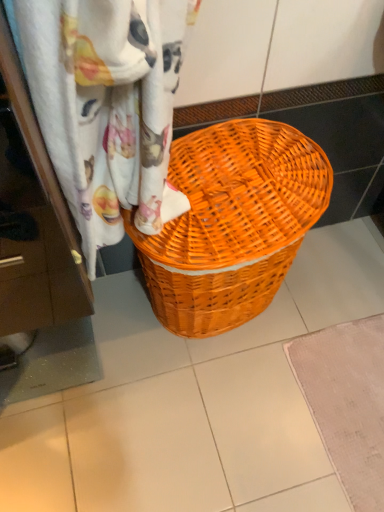
Measure the distance between woven fabric curtain at upper center and camera.

The depth of woven fabric curtain at upper center is 16.26 inches.

Describe the element at coordinates (232, 223) in the screenshot. I see `orange wicker basket at center` at that location.

Locate an element on the screen. woven fabric curtain at upper center is located at coordinates click(108, 106).

Considering the relative sizes of woven fabric curtain at upper center and beige textured bath mat at lower right in the image provided, is woven fabric curtain at upper center taller than beige textured bath mat at lower right?

Yes.

In the image, is woven fabric curtain at upper center positioned in front of or behind beige textured bath mat at lower right?

woven fabric curtain at upper center is in front of beige textured bath mat at lower right.

Considering the relative sizes of woven fabric curtain at upper center and beige textured bath mat at lower right in the image provided, is woven fabric curtain at upper center thinner than beige textured bath mat at lower right?

Yes, woven fabric curtain at upper center is thinner than beige textured bath mat at lower right.

Is orange wicker basket at center shorter than beige textured bath mat at lower right?

Incorrect, the height of orange wicker basket at center does not fall short of that of beige textured bath mat at lower right.

From a real-world perspective, which is physically above, orange wicker basket at center or beige textured bath mat at lower right?

orange wicker basket at center, from a real-world perspective.

Can you tell me how much woven fabric curtain at upper center and orange wicker basket at center differ in facing direction?

There is a 2.81-degree angle between the facing directions of woven fabric curtain at upper center and orange wicker basket at center.

From a real-world perspective, is woven fabric curtain at upper center positioned above or below orange wicker basket at center?

Clearly, from a real-world perspective, woven fabric curtain at upper center is above orange wicker basket at center.

Which is behind, woven fabric curtain at upper center or orange wicker basket at center?

orange wicker basket at center is behind.

Does point (94, 179) come in front of point (173, 265)?

Yes, it is.

Considering the relative sizes of orange wicker basket at center and woven fabric curtain at upper center in the image provided, is orange wicker basket at center wider than woven fabric curtain at upper center?

Yes, orange wicker basket at center is wider than woven fabric curtain at upper center.

From a real-world perspective, who is located lower, orange wicker basket at center or woven fabric curtain at upper center?

orange wicker basket at center.

The width and height of the screenshot is (384, 512). Find the location of `curtain on the left of the orange wicker basket at center`. curtain on the left of the orange wicker basket at center is located at coordinates coord(108,106).

From a real-world perspective, relative to orange wicker basket at center, is beige textured bath mat at lower right vertically above or below?

Clearly, from a real-world perspective, beige textured bath mat at lower right is below orange wicker basket at center.

Image resolution: width=384 pixels, height=512 pixels. In order to click on picnic basket lying above the beige textured bath mat at lower right (from the image's perspective) in this screenshot , I will do `click(232, 223)`.

Consider the image. How distant is beige textured bath mat at lower right from orange wicker basket at center?

beige textured bath mat at lower right and orange wicker basket at center are 15.15 inches apart from each other.

Is beige textured bath mat at lower right not within orange wicker basket at center?

Yes, beige textured bath mat at lower right is outside of orange wicker basket at center.

From a real-world perspective, is beige textured bath mat at lower right below woven fabric curtain at upper center?

Yes.

From the picture: Would you say beige textured bath mat at lower right is a long distance from woven fabric curtain at upper center?

No, beige textured bath mat at lower right is in close proximity to woven fabric curtain at upper center.

Can you confirm if beige textured bath mat at lower right is shorter than woven fabric curtain at upper center?

Yes.

Find the location of a particular element. Image resolution: width=384 pixels, height=512 pixels. curtain above the beige textured bath mat at lower right (from the image's perspective) is located at coordinates (108, 106).

Find the location of a particular element. bath mat lying on the right of orange wicker basket at center is located at coordinates (347, 402).

Estimate the real-world distances between objects in this image. Which object is closer to woven fabric curtain at upper center, orange wicker basket at center or beige textured bath mat at lower right?

The object closer to woven fabric curtain at upper center is orange wicker basket at center.

Which object lies nearer to the anchor point beige textured bath mat at lower right, woven fabric curtain at upper center or orange wicker basket at center?

orange wicker basket at center.

From the image, which object appears to be farther from woven fabric curtain at upper center, beige textured bath mat at lower right or orange wicker basket at center?

The object further to woven fabric curtain at upper center is beige textured bath mat at lower right.

Considering their positions, is orange wicker basket at center positioned closer to beige textured bath mat at lower right than woven fabric curtain at upper center?

Among the two, orange wicker basket at center is located nearer to beige textured bath mat at lower right.

When comparing their distances from orange wicker basket at center, does woven fabric curtain at upper center or beige textured bath mat at lower right seem closer?

Based on the image, woven fabric curtain at upper center appears to be nearer to orange wicker basket at center.

Which object lies nearer to the anchor point orange wicker basket at center, beige textured bath mat at lower right or woven fabric curtain at upper center?

woven fabric curtain at upper center is positioned closer to the anchor orange wicker basket at center.

At what (x,y) coordinates should I click in order to perform the action: click on picnic basket between woven fabric curtain at upper center and beige textured bath mat at lower right in the vertical direction. Please return your answer as a coordinate pair (x, y). Looking at the image, I should click on (232, 223).